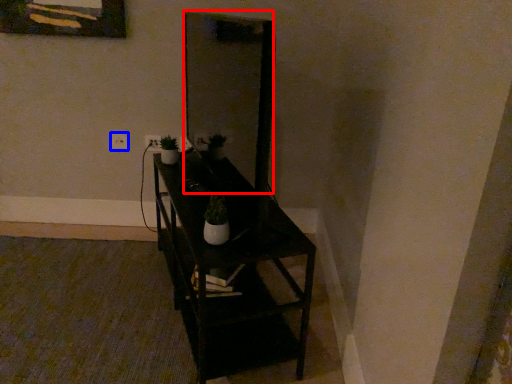
Question: Which point is further to the camera, mirror (highlighted by a red box) or electric outlet (highlighted by a blue box)?

Choices:
 (A) mirror
 (B) electric outlet

Answer: (B)